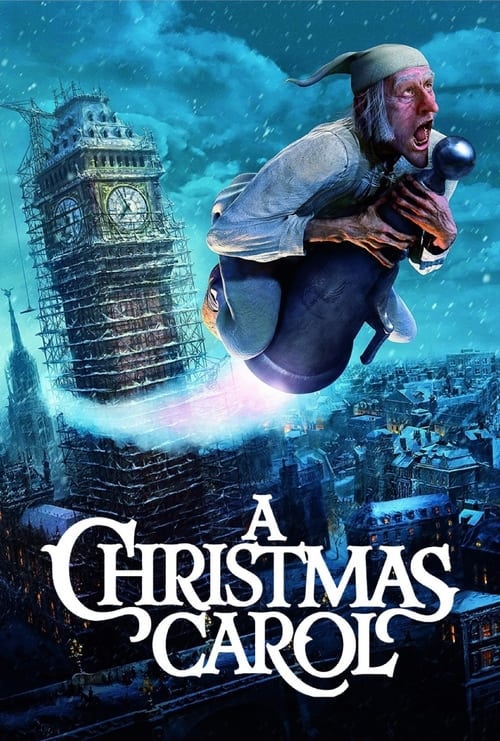
This screenshot has height=741, width=500. Find the location of `clock`. clock is located at coordinates (126, 202).